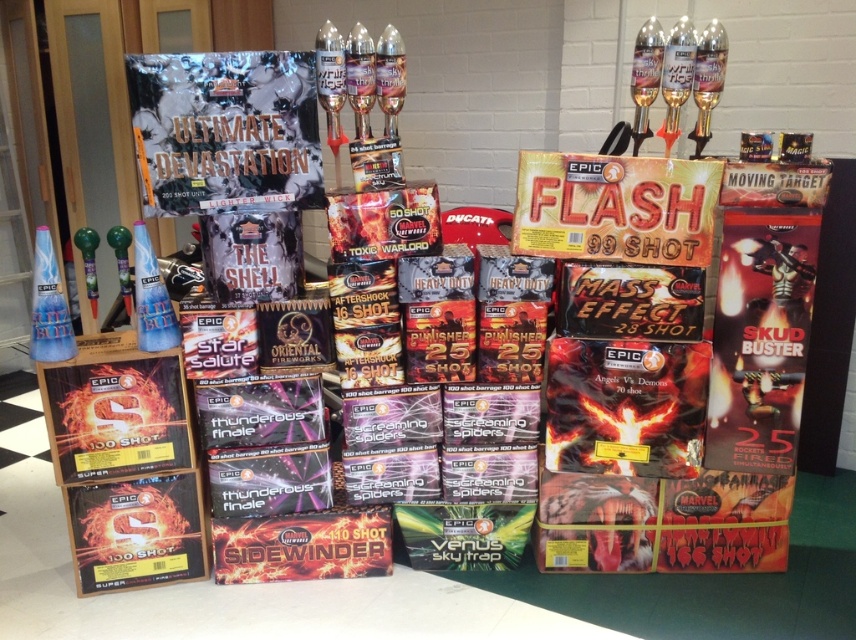
You are standing in front of the fireworks display and want to pick up an item. Which of the two points, point (235, 90) or point (122, 442), is closer to you?

Point (235, 90) is closer to the viewer than point (122, 442).

You are a customer in the fireworks store and want to pick up both the matte black comic book at upper left and the matte black box at lower left. Which one would you need to bend down less to reach?

The matte black comic book at upper left is closer to the viewer than the matte black box at lower left, so you would need to bend down less to reach the matte black comic book at upper left.

Based on the photo, you are a customer in the fireworks store and want to know which item is taller between the matte black comic book at upper left and the matte black box at lower left. Can you help me determine this?

The matte black comic book at upper left has a greater height compared to the matte black box at lower left, so the matte black comic book at upper left is taller.